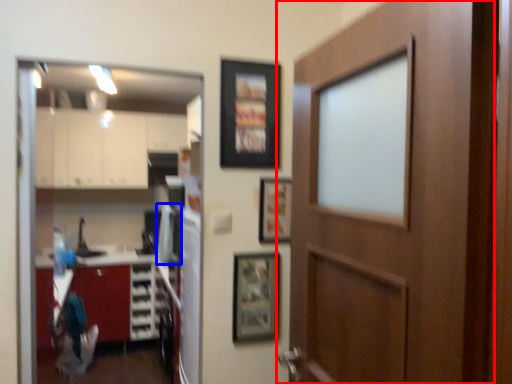
Question: Which object appears farthest to the camera in this image, door (highlighted by a red box) or appliance (highlighted by a blue box)?

Choices:
 (A) door
 (B) appliance

Answer: (B)